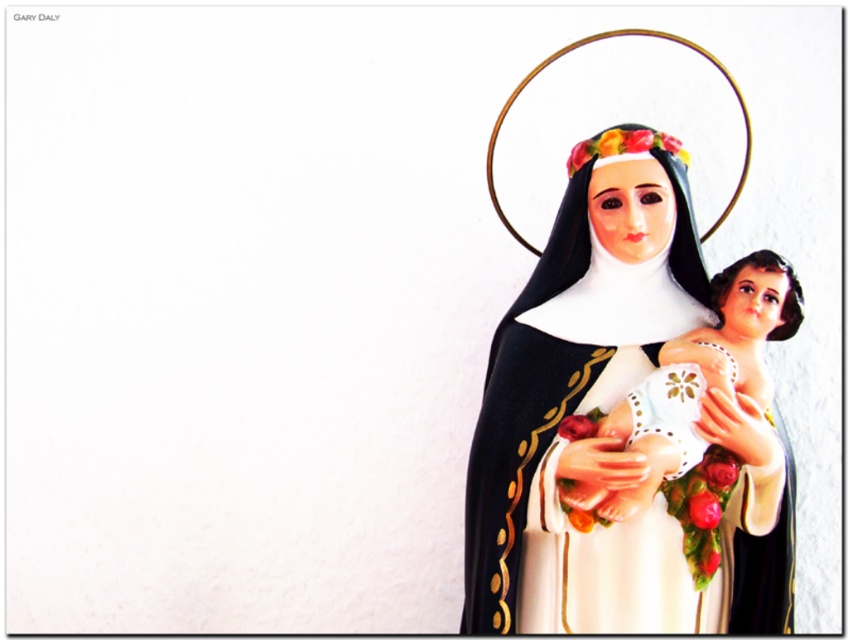
Question: Does matte porcelain statue at right have a lesser width compared to white lace baby at center?

Choices:
 (A) yes
 (B) no

Answer: (B)

Question: Is matte porcelain statue at right bigger than white lace baby at center?

Choices:
 (A) yes
 (B) no

Answer: (A)

Question: From the image, what is the correct spatial relationship of matte porcelain statue at right in relation to white lace baby at center?

Choices:
 (A) below
 (B) above

Answer: (B)